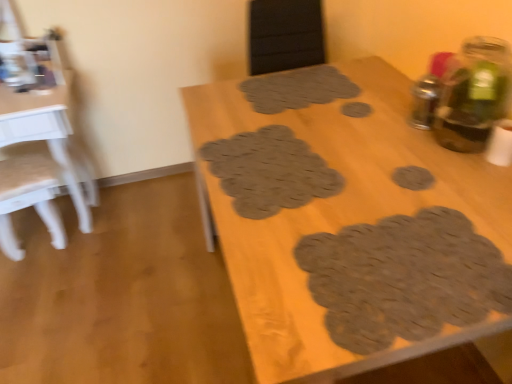
I want to click on vacant space behind metallic silver bottle at upper right, the second bottle viewed from the front, so click(386, 100).